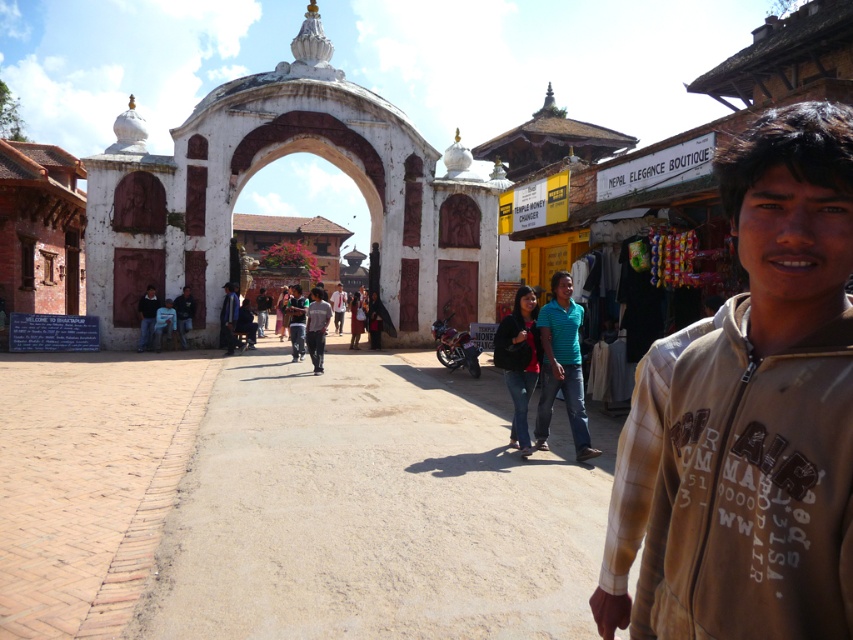
You are a photographer standing in the street scene and want to take a photo that includes both the teal striped shirt at center and the dark blue shirt at center. Which shirt should you focus on to ensure both are in the frame?

The teal striped shirt at center is much taller than the dark blue shirt at center, so focusing on the teal striped shirt at center will ensure both are in the frame since it occupies more vertical space.

You are a photographer trying to capture both the dark brown leather jacket at lower left and the light brown leather jacket at center in a single frame. Which jacket should you focus on to ensure both are visible without cropping?

You should focus on the dark brown leather jacket at lower left because it occupies less space and the light brown leather jacket at center takes up more area, allowing both to fit within the frame.

You are a photographer standing in the street scene and want to capture both the dark blue shirt at center and the dark blue shirt at lower left in your photo. Which dark blue shirt should you focus on to ensure the one in the background is clearly visible?

The dark blue shirt at center has a greater height compared to dark blue shirt at lower left, so focusing on the dark blue shirt at center will ensure the one in the background is clearly visible.